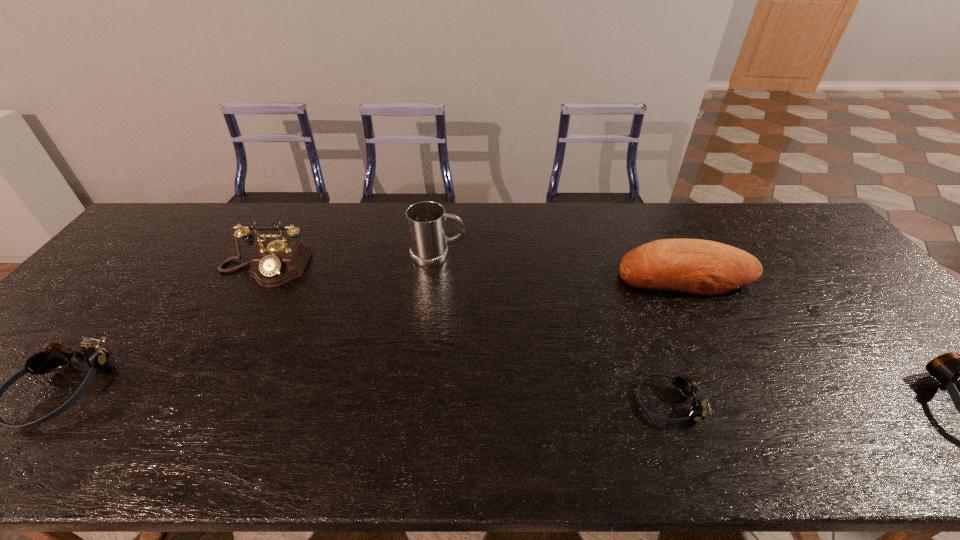
Please point a location where one more goggles can be added evenly. Please provide its 2D coordinates. Your answer should be formatted as a tuple, i.e. [(x, y)], where the tuple contains the x and y coordinates of a point satisfying the conditions above.

[(360, 396)]